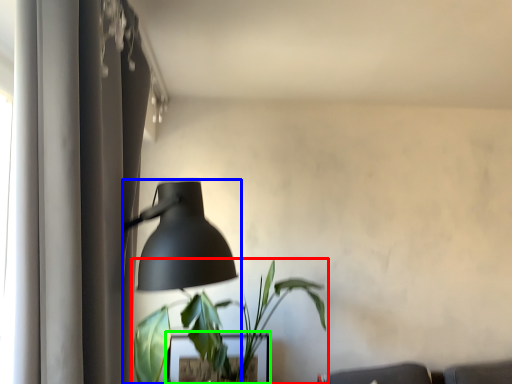
Question: Estimate the real-world distances between objects in this image. Which object is farther from houseplant (highlighted by a red box), lamp (highlighted by a blue box) or table (highlighted by a green box)?

Choices:
 (A) lamp
 (B) table

Answer: (B)